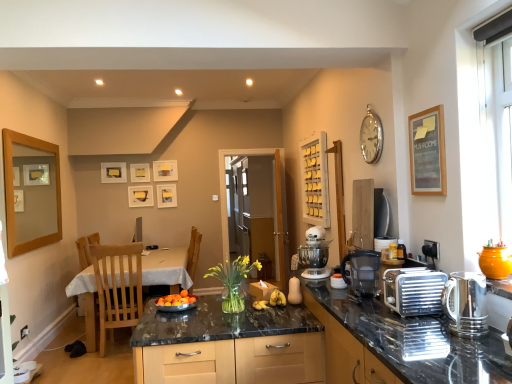
Locate an element on the screen. The image size is (512, 384). vacant space to the left of silver metallic toaster at right, the first appliance in the back-to-front sequence is located at coordinates (366, 312).